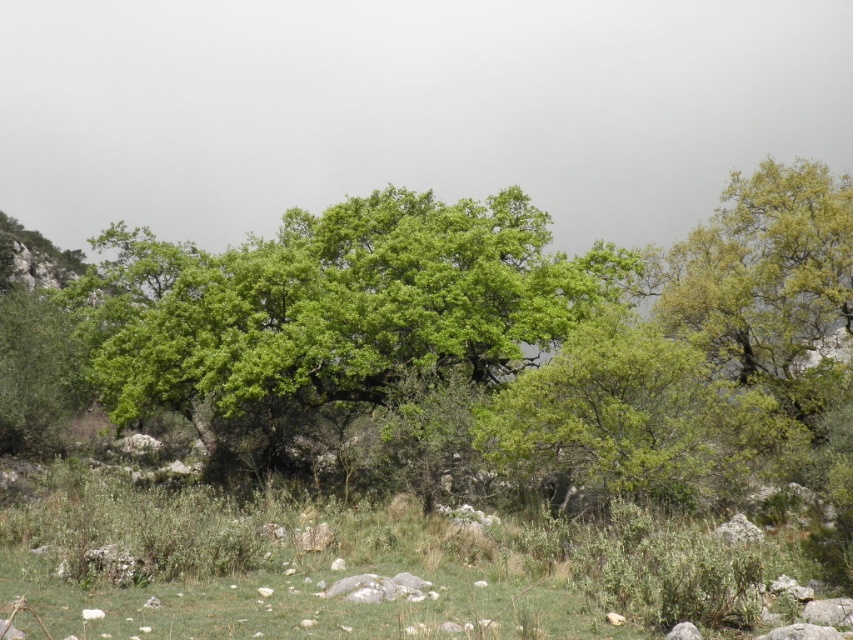
Does point (65, 595) come farther from viewer compared to point (381, 257)?

No, (65, 595) is closer to viewer.

Between point (654, 552) and point (166, 244), which one is positioned behind?

The point (166, 244) is more distant.

What are the coordinates of `green grass at center` in the screenshot? It's located at (381, 570).